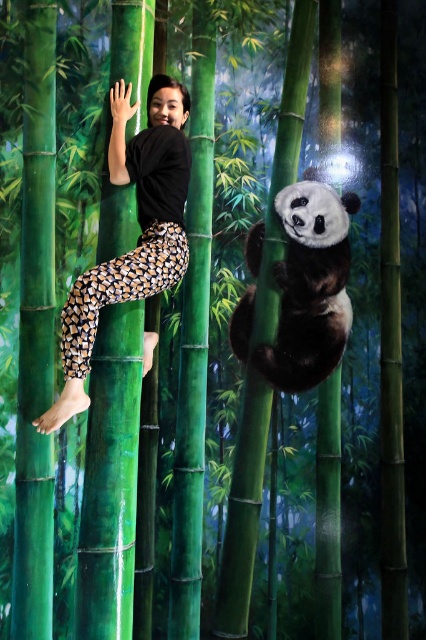
Between point (132, 164) and point (282, 214), which one is positioned in front?

Positioned in front is point (132, 164).

Is black matte leggings at upper center taller than fluffy white panda at right?

Indeed, black matte leggings at upper center has a greater height compared to fluffy white panda at right.

Is point (143, 193) less distant than point (322, 333)?

Yes.

Locate an element on the screen. black matte leggings at upper center is located at coordinates (140, 236).